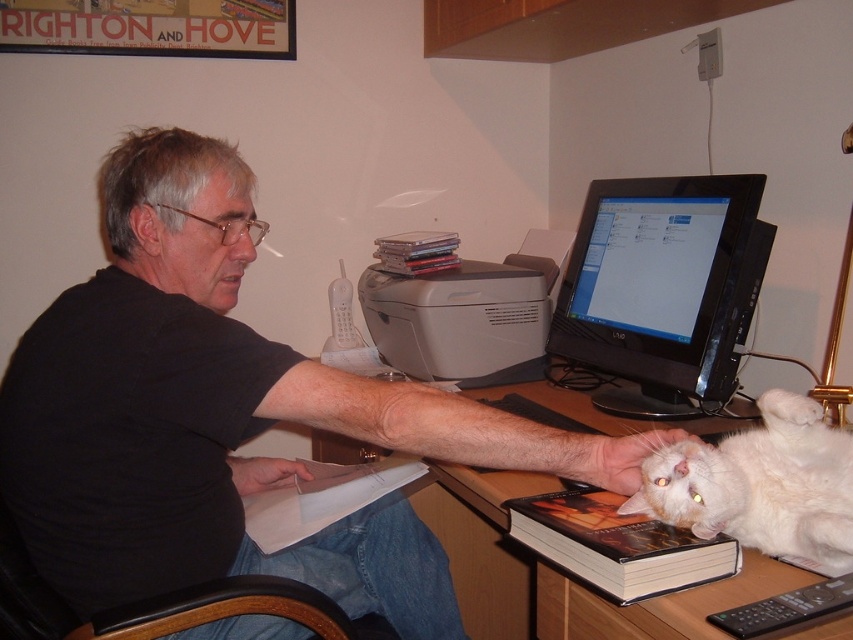
Question: Considering the real-world distances, which object is farthest from the gray matte printer at center?

Choices:
 (A) black matte shirt at upper left
 (B) wooden desk at center
 (C) white fluffy cat at lower right

Answer: (C)

Question: Does black glossy monitor at upper right appear on the left side of gray matte printer at center?

Choices:
 (A) no
 (B) yes

Answer: (A)

Question: Does hardcover book at lower right have a larger size compared to white paper at lower center?

Choices:
 (A) yes
 (B) no

Answer: (B)

Question: Is white fluffy cat at lower right above hardcover book at lower right?

Choices:
 (A) yes
 (B) no

Answer: (A)

Question: Based on their relative distances, which object is farther from the black glossy monitor at upper right?

Choices:
 (A) black matte shirt at upper left
 (B) white fluffy cat at lower right
 (C) gray matte printer at center
 (D) hardcover book at lower right

Answer: (A)

Question: Which is farther from the hardcover book at lower right?

Choices:
 (A) black matte shirt at upper left
 (B) gray matte printer at center
 (C) black glossy monitor at upper right

Answer: (B)